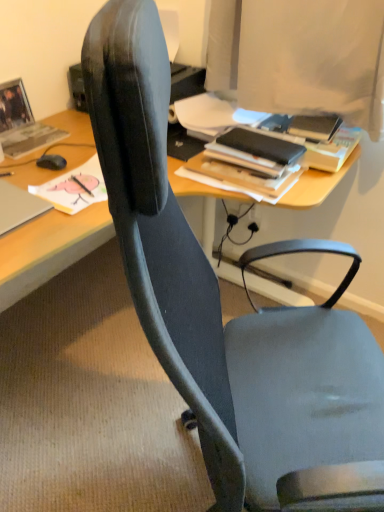
Question: Looking at their shapes, would you say matte gray book at upper left, arranged as the 3th book when viewed from the right, is wider or thinner than black matte book at upper right, the 3th book viewed from the left?

Choices:
 (A) thin
 (B) wide

Answer: (A)

Question: Looking at the image, does matte gray book at upper left, arranged as the 3th book when viewed from the right, seem bigger or smaller compared to black matte book at upper right, the first book from the right?

Choices:
 (A) big
 (B) small

Answer: (B)

Question: Considering the real-world distances, which object is farthest from the black matte mouse at left?

Choices:
 (A) matte gray book at upper left, the first book in the left-to-right sequence
 (B) matte black book at upper left, the second book positioned from the left
 (C) black matte book at upper right, the first book from the right

Answer: (C)

Question: Estimate the real-world distances between objects in this image. Which object is farther from the matte gray book at upper left, arranged as the 3th book when viewed from the right?

Choices:
 (A) matte black book at upper left, positioned as the 2th book in right-to-left order
 (B) black matte book at upper right, the 3th book viewed from the left
 (C) black matte mouse at left

Answer: (B)